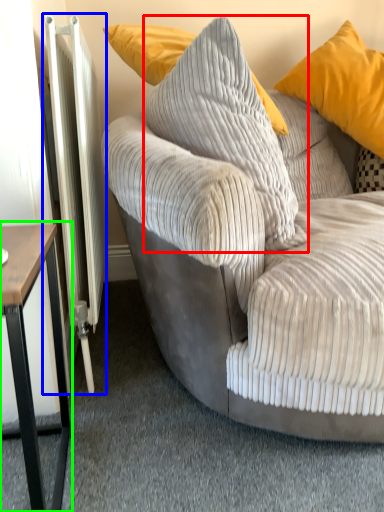
Question: Considering the real-world distances, which object is closest to pillow (highlighted by a red box)? radiator (highlighted by a blue box) or table (highlighted by a green box).

Choices:
 (A) radiator
 (B) table

Answer: (A)